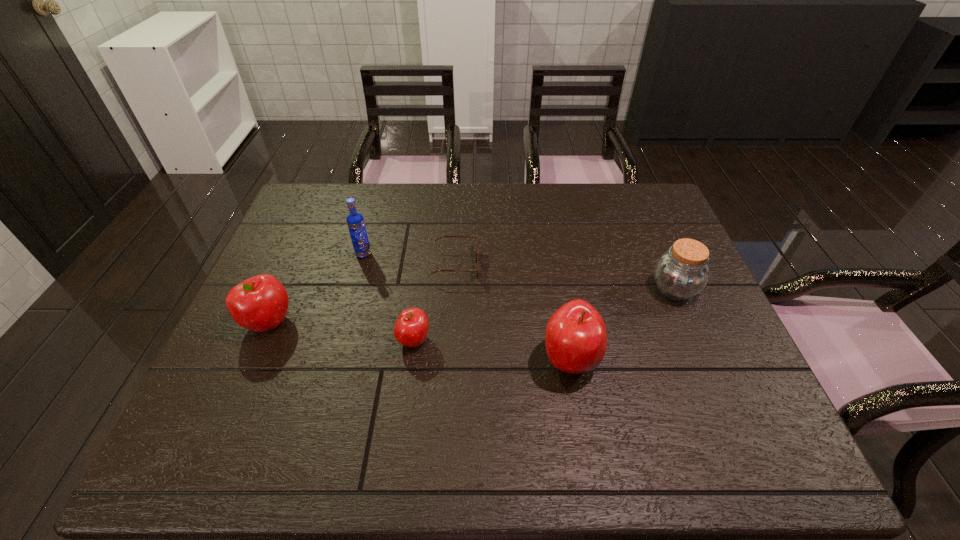
Locate an element on the screen. blank space located on the left of the fifth object from left to right is located at coordinates (472, 360).

The height and width of the screenshot is (540, 960). Find the location of `free space located on the back of the second object from left to right`. free space located on the back of the second object from left to right is located at coordinates (372, 222).

You are a GUI agent. You are given a task and a screenshot of the screen. Output one action in this format:
    pyautogui.click(x=<x>, y=<y>)
    Task: Click on the vacant space located on the left of the rightmost object
    The height and width of the screenshot is (540, 960).
    Given the screenshot: What is the action you would take?
    pos(539,289)

This screenshot has width=960, height=540. I want to click on free region located 0.100m at the front view of the spectacles, so click(513, 265).

Find the location of a particular element. object present at the near edge is located at coordinates (575, 338).

Identify the location of object at the left edge. (260, 303).

At what (x,y) coordinates should I click in order to perform the action: click on object that is at the right edge. Please return your answer as a coordinate pair (x, y). Image resolution: width=960 pixels, height=540 pixels. Looking at the image, I should click on (680, 273).

The width and height of the screenshot is (960, 540). In order to click on vacant area at the far edge in this screenshot , I will do `click(544, 205)`.

Where is `vacant space at the near edge of the desktop`? The width and height of the screenshot is (960, 540). vacant space at the near edge of the desktop is located at coordinates (328, 415).

I want to click on vacant point at the left edge, so click(x=336, y=227).